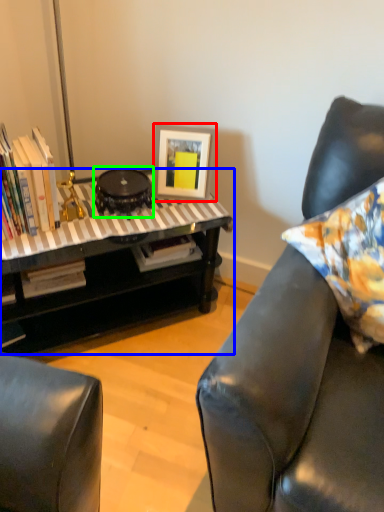
Question: Estimate the real-world distances between objects in this image. Which object is farther from picture frame (highlighted by a red box), table (highlighted by a blue box) or round table (highlighted by a green box)?

Choices:
 (A) table
 (B) round table

Answer: (A)